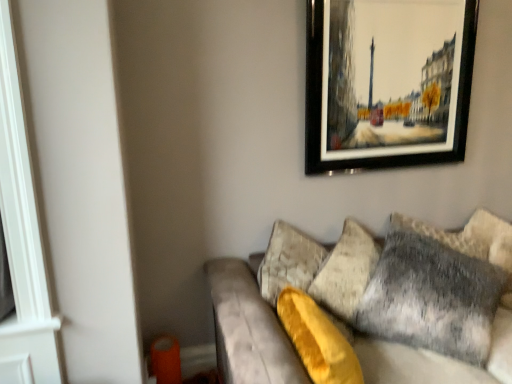
Question: From a real-world perspective, is gray furry pillow at right on velvet gray couch at lower right?

Choices:
 (A) yes
 (B) no

Answer: (A)

Question: Is velvet gray couch at lower right at the back of gray furry pillow at right?

Choices:
 (A) yes
 (B) no

Answer: (A)

Question: Could you tell me if gray furry pillow at right is turned towards velvet gray couch at lower right?

Choices:
 (A) no
 (B) yes

Answer: (B)

Question: Can velvet gray couch at lower right be found inside gray furry pillow at right?

Choices:
 (A) yes
 (B) no

Answer: (B)

Question: Is gray furry pillow at right thinner than velvet gray couch at lower right?

Choices:
 (A) yes
 (B) no

Answer: (A)

Question: Is velvet gray couch at lower right inside or outside of black-framed painting at upper right?

Choices:
 (A) inside
 (B) outside

Answer: (B)

Question: Based on their sizes in the image, would you say velvet gray couch at lower right is bigger or smaller than black-framed painting at upper right?

Choices:
 (A) big
 (B) small

Answer: (A)

Question: Considering the positions of velvet gray couch at lower right and black-framed painting at upper right in the image, is velvet gray couch at lower right taller or shorter than black-framed painting at upper right?

Choices:
 (A) tall
 (B) short

Answer: (B)

Question: Is velvet gray couch at lower right in front of or behind black-framed painting at upper right in the image?

Choices:
 (A) front
 (B) behind

Answer: (A)

Question: Choose the correct answer: Is velvet gray couch at lower right inside gray furry pillow at right or outside it?

Choices:
 (A) inside
 (B) outside

Answer: (B)

Question: Is point [x=498, y=230] positioned closer to the camera than point [x=412, y=258]?

Choices:
 (A) farther
 (B) closer

Answer: (A)

Question: Based on their sizes in the image, would you say velvet gray couch at lower right is bigger or smaller than gray furry pillow at right?

Choices:
 (A) big
 (B) small

Answer: (A)

Question: From their relative heights in the image, would you say velvet gray couch at lower right is taller or shorter than gray furry pillow at right?

Choices:
 (A) short
 (B) tall

Answer: (A)

Question: From the image's perspective, is gray furry pillow at right positioned above or below velvet gray couch at lower right?

Choices:
 (A) below
 (B) above

Answer: (B)

Question: Would you say gray furry pillow at right is to the left or to the right of velvet gray couch at lower right in the picture?

Choices:
 (A) right
 (B) left

Answer: (B)